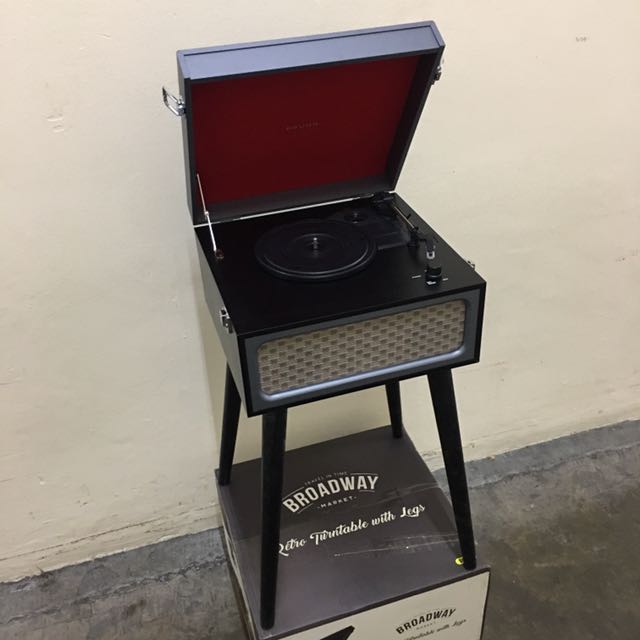
This screenshot has height=640, width=640. Identify the location of wall. coord(152,301).